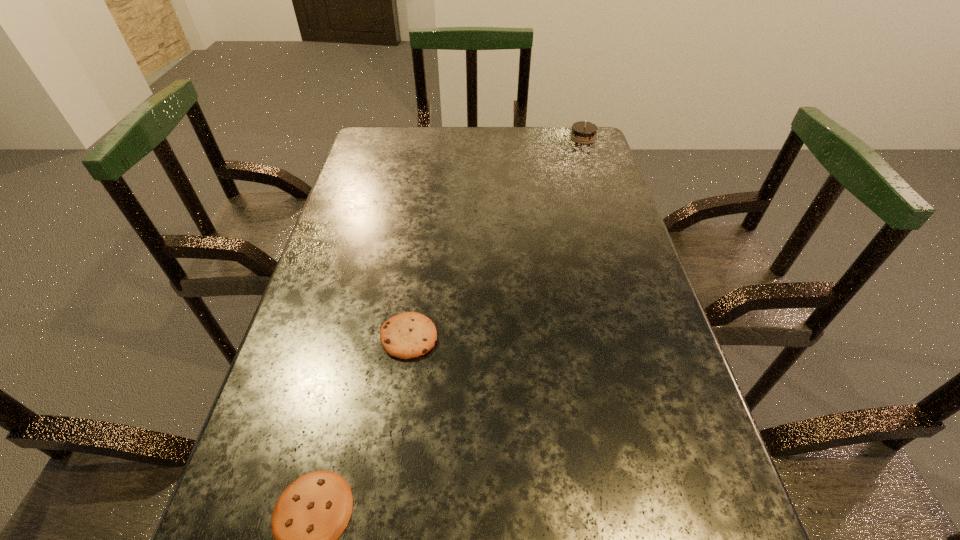
You are a GUI agent. You are given a task and a screenshot of the screen. Output one action in this format:
    pyautogui.click(x=<x>, y=<y>)
    Task: Click on the vacant region at the left edge
    The image size is (960, 540).
    Given the screenshot: What is the action you would take?
    pyautogui.click(x=366, y=286)

Locate an element on the screen. This screenshot has height=540, width=960. vacant space at the right edge of the desktop is located at coordinates (612, 289).

In the image, there is a desktop. In order to click on free region at the far left corner in this screenshot , I will do `click(395, 136)`.

Where is `vacant region between the taller cookie and the rightmost object`? Image resolution: width=960 pixels, height=540 pixels. vacant region between the taller cookie and the rightmost object is located at coordinates (496, 238).

You are a GUI agent. You are given a task and a screenshot of the screen. Output one action in this format:
    pyautogui.click(x=<x>, y=<y>)
    Task: Click on the free space between the farthest object and the taller cookie
    Image resolution: width=960 pixels, height=540 pixels.
    Given the screenshot: What is the action you would take?
    pyautogui.click(x=496, y=238)

I want to click on free space between the rightmost object and the second farthest object, so click(x=496, y=238).

The image size is (960, 540). In order to click on unoccupied position between the farthest object and the taller cookie in this screenshot , I will do `click(496, 238)`.

The width and height of the screenshot is (960, 540). Find the location of `object identified as the second closest to the chocolate cake`. object identified as the second closest to the chocolate cake is located at coordinates (313, 511).

Image resolution: width=960 pixels, height=540 pixels. I want to click on object that is the closest one to the second nearest object, so [x=313, y=511].

This screenshot has height=540, width=960. I want to click on free location that satisfies the following two spatial constraints: 1. on the back side of the farther cookie; 2. on the left side of the chocolate cake, so click(x=437, y=138).